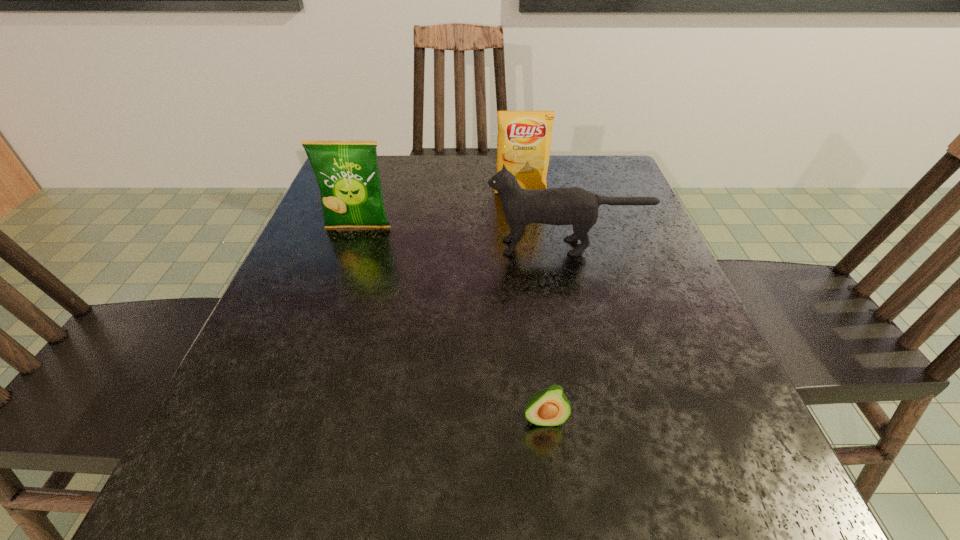
This screenshot has width=960, height=540. What are the coordinates of `free space between the third farthest object and the nearest object` in the screenshot? It's located at (555, 333).

The width and height of the screenshot is (960, 540). Find the location of `free point between the farther crisp (potato chip) and the leftmost object`. free point between the farther crisp (potato chip) and the leftmost object is located at coordinates (440, 211).

Identify the location of blank region between the cat and the nearer crisp (potato chip). The width and height of the screenshot is (960, 540). (462, 237).

You are a GUI agent. You are given a task and a screenshot of the screen. Output one action in this format:
    pyautogui.click(x=<x>, y=<y>)
    Task: Click on the blank region between the second nearest object and the nearest object
    Image resolution: width=960 pixels, height=540 pixels.
    Given the screenshot: What is the action you would take?
    pyautogui.click(x=555, y=333)

You are a GUI agent. You are given a task and a screenshot of the screen. Output one action in this format:
    pyautogui.click(x=<x>, y=<y>)
    Task: Click on the vacant area that lies between the shortest object and the cat
    This screenshot has width=960, height=540.
    Given the screenshot: What is the action you would take?
    555,333

Image resolution: width=960 pixels, height=540 pixels. I want to click on vacant region between the avocado and the third farthest object, so click(555, 333).

Where is `vacant region between the cat and the nearest object`? vacant region between the cat and the nearest object is located at coordinates (555, 333).

Locate an element on the screen. This screenshot has height=540, width=960. free space that is in between the third farthest object and the third nearest object is located at coordinates (462, 237).

In order to click on unoccupied area between the leftmost object and the right crisp (potato chip) in this screenshot , I will do `click(440, 211)`.

Find the location of a particular element. object identified as the second closest to the right crisp (potato chip) is located at coordinates (347, 173).